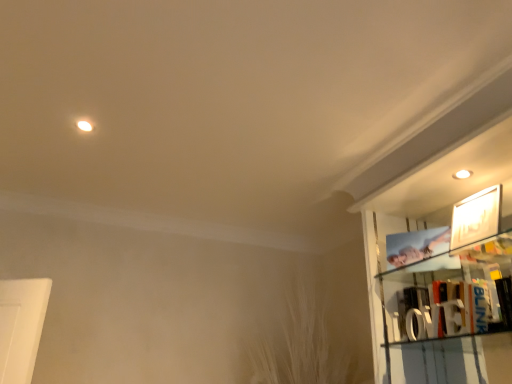
The height and width of the screenshot is (384, 512). What do you see at coordinates (442, 310) in the screenshot?
I see `white wooden letters at lower right` at bounding box center [442, 310].

At what (x,y) coordinates should I click in order to perform the action: click on white wooden letters at lower right. Please return your answer as a coordinate pair (x, y). The height and width of the screenshot is (384, 512). Looking at the image, I should click on (442, 310).

At what (x,y) coordinates should I click in order to perform the action: click on white wooden letters at lower right. Please return your answer as a coordinate pair (x, y). Looking at the image, I should click on (442, 310).